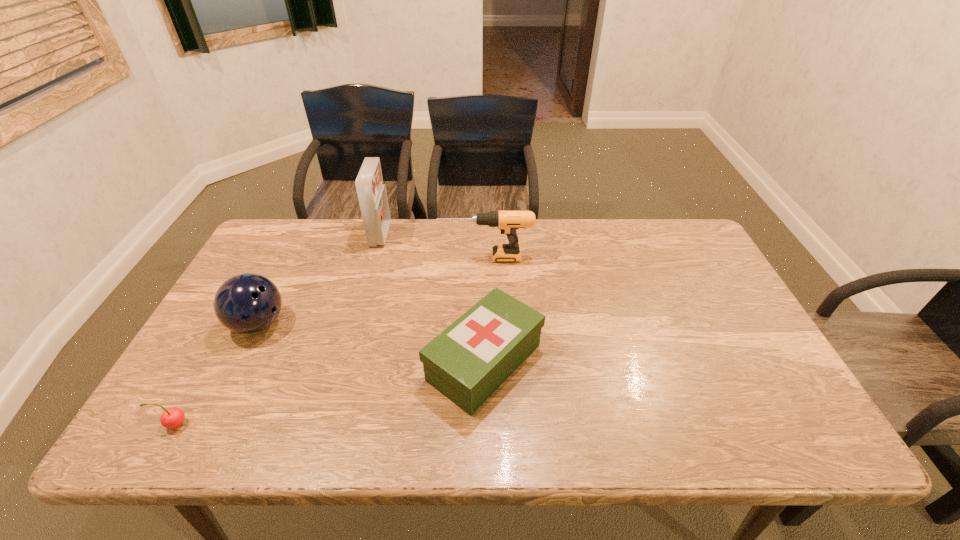
Find the location of a particular element. This screenshot has width=960, height=540. object located in the near left corner section of the desktop is located at coordinates (171, 418).

You are a GUI agent. You are given a task and a screenshot of the screen. Output one action in this format:
    pyautogui.click(x=<x>, y=<y>)
    Task: Click on the free space at the far edge of the desktop
    The width and height of the screenshot is (960, 540).
    Given the screenshot: What is the action you would take?
    pyautogui.click(x=408, y=230)

In the image, there is a desktop. Identify the location of vacant space at the near edge. This screenshot has height=540, width=960. (347, 430).

The height and width of the screenshot is (540, 960). I want to click on vacant space at the right edge of the desktop, so click(700, 272).

The width and height of the screenshot is (960, 540). Find the location of `free space at the far right corner of the desktop`. free space at the far right corner of the desktop is located at coordinates (x=665, y=250).

Image resolution: width=960 pixels, height=540 pixels. I want to click on vacant space at the near right corner of the desktop, so click(803, 448).

Identify the location of empty location between the shortest object and the tallest object. Image resolution: width=960 pixels, height=540 pixels. (277, 329).

You are a GUI agent. You are given a task and a screenshot of the screen. Output one action in this format:
    pyautogui.click(x=<x>, y=<y>)
    Task: Click on the empty space that is in between the bowling ball and the left first-aid kit
    
    Given the screenshot: What is the action you would take?
    pyautogui.click(x=320, y=279)

Locate an element on the screen. The height and width of the screenshot is (540, 960). free space between the third object from right to left and the nearer first-aid kit is located at coordinates (432, 299).

Where is `empty location between the bowling ball and the shorter first-aid kit`? The width and height of the screenshot is (960, 540). empty location between the bowling ball and the shorter first-aid kit is located at coordinates (372, 343).